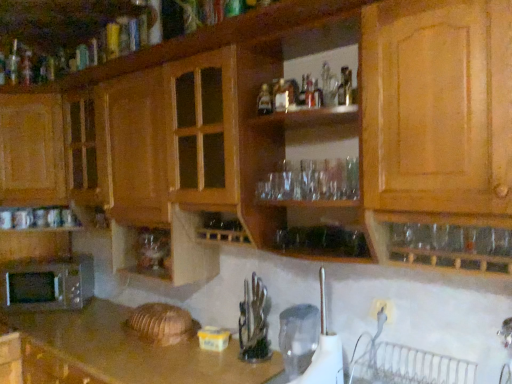
Locate an element on the screen. free point above transparent plastic pitcher at lower center, which is the second appliance from front to back (from a real-world perspective) is located at coordinates (306, 309).